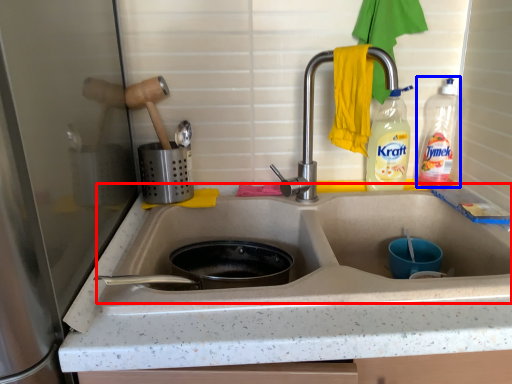
Question: Which object is further to the camera taking this photo, sink (highlighted by a red box) or bottle (highlighted by a blue box)?

Choices:
 (A) sink
 (B) bottle

Answer: (B)